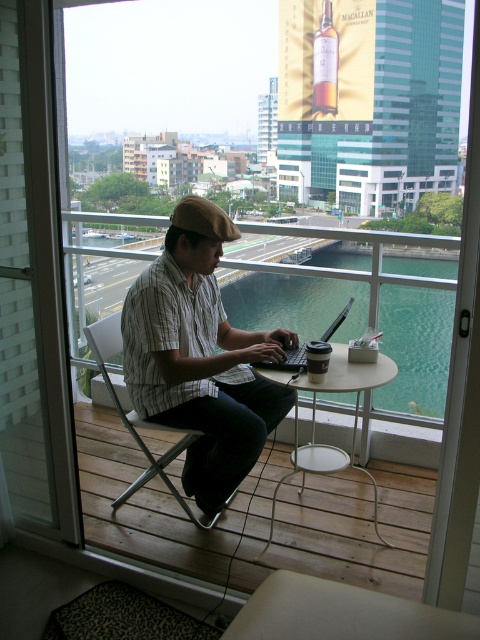
Question: Estimate the real-world distances between objects in this image. Which object is closer to the white metal table at center?

Choices:
 (A) striped cotton shirt at center
 (B) leopard print rug at lower left
 (C) metallic silver chair at center
 (D) black plastic laptop at center

Answer: (A)

Question: From the image, what is the correct spatial relationship of striped cotton shirt at center in relation to metallic silver chair at center?

Choices:
 (A) below
 (B) above

Answer: (B)

Question: Based on their relative distances, which object is nearer to the black plastic laptop at center?

Choices:
 (A) white metal table at center
 (B) leopard print rug at lower left

Answer: (A)

Question: Can you confirm if striped cotton shirt at center is wider than leopard print rug at lower left?

Choices:
 (A) no
 (B) yes

Answer: (B)

Question: Which point is farther to the camera?

Choices:
 (A) (327, 445)
 (B) (130, 595)
 (C) (283, 369)

Answer: (A)

Question: In this image, where is white metal table at center located relative to metallic silver chair at center?

Choices:
 (A) left
 (B) right

Answer: (B)